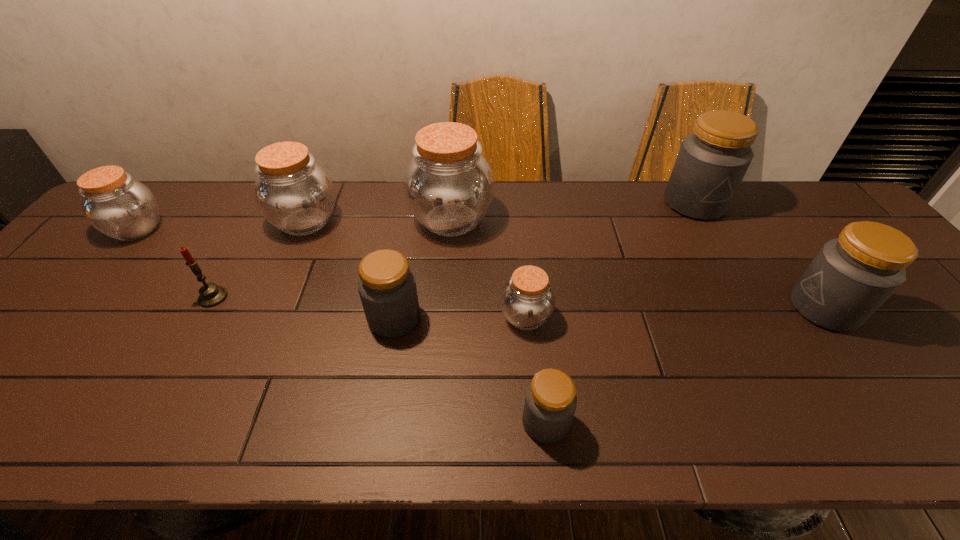
At what (x,y) coordinates should I click in order to perform the action: click on the farthest gray jar. Please return your answer as a coordinate pair (x, y). Image resolution: width=960 pixels, height=540 pixels. Looking at the image, I should click on (711, 164).

Image resolution: width=960 pixels, height=540 pixels. Find the location of `the biggest brown jar`. the biggest brown jar is located at coordinates (448, 184).

You are a GUI agent. You are given a task and a screenshot of the screen. Output one action in this format:
    pyautogui.click(x=<x>, y=<y>)
    Task: Click on the third object from left to right
    The image size is (960, 540).
    Given the screenshot: What is the action you would take?
    295,194

The height and width of the screenshot is (540, 960). What are the coordinates of `the second brown jar from left to right` in the screenshot? It's located at (295, 194).

Locate an element on the screen. The width and height of the screenshot is (960, 540). the third smallest gray jar is located at coordinates (851, 276).

Locate an element on the screen. This screenshot has width=960, height=540. the leftmost object is located at coordinates (116, 205).

At what (x,y) coordinates should I click in order to perform the action: click on the leftmost jar. Please return your answer as a coordinate pair (x, y). This screenshot has width=960, height=540. Looking at the image, I should click on (116, 205).

Identify the location of the third biggest gray jar. (387, 287).

This screenshot has width=960, height=540. I want to click on red candle, so click(211, 295).

Image resolution: width=960 pixels, height=540 pixels. I want to click on the eighth object from right to left, so click(x=211, y=295).